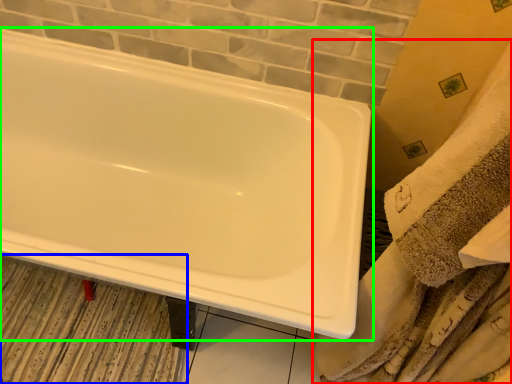
Question: Which object is the farthest from bath towel (highlighted by a red box)? Choose among these: bath mat (highlighted by a blue box) or bathtub (highlighted by a green box).

Choices:
 (A) bath mat
 (B) bathtub

Answer: (A)